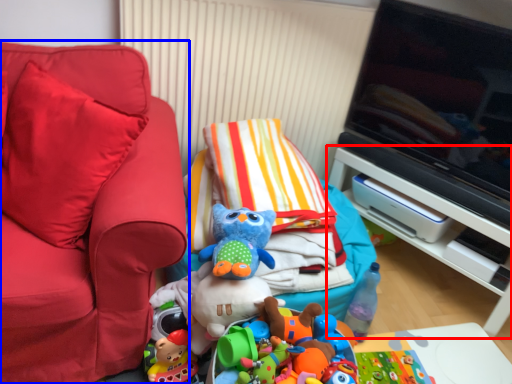
Question: Among these objects, which one is nearest to the camera, furniture (highlighted by a red box) or furniture (highlighted by a blue box)?

Choices:
 (A) furniture
 (B) furniture

Answer: (B)